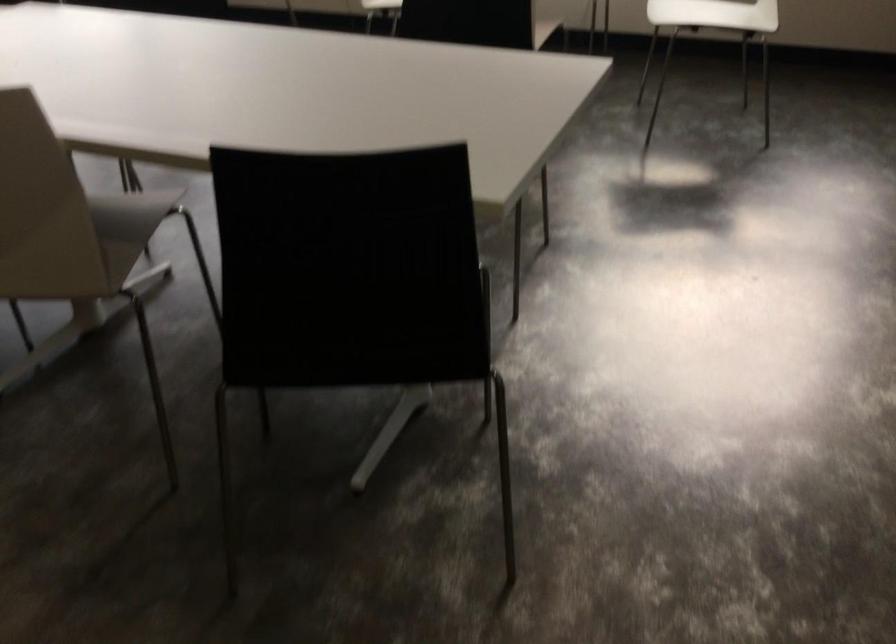
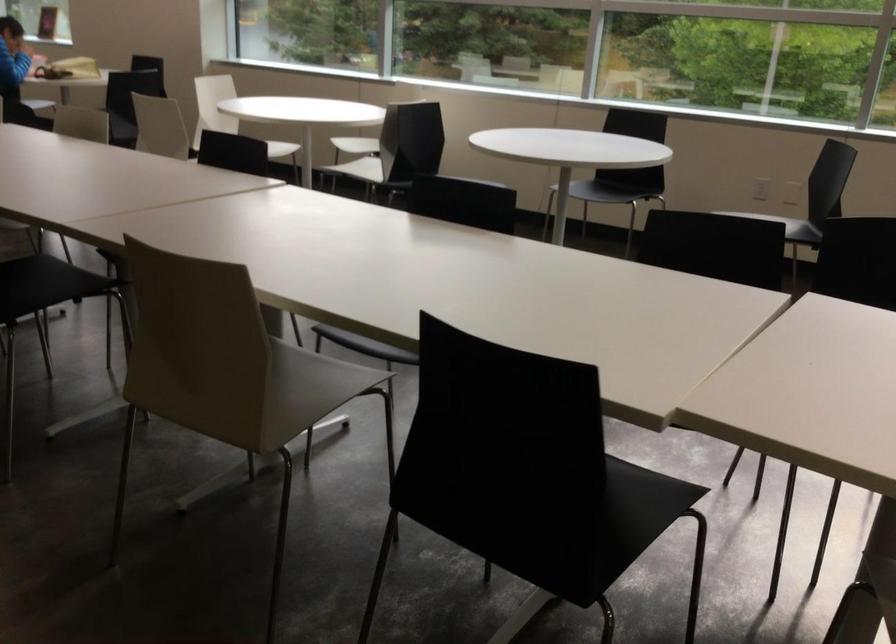
Question: Which direction would the cameraman need to move to produce the second image? Reply with the corresponding letter.

Choices:
 (A) Left
 (B) Right
 (C) Forward
 (D) Backward

Answer: (A)